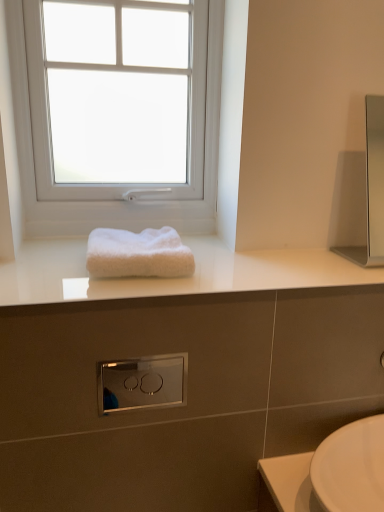
In order to click on vacant area that is in front of white fluffy towel at center in this screenshot , I will do `click(106, 291)`.